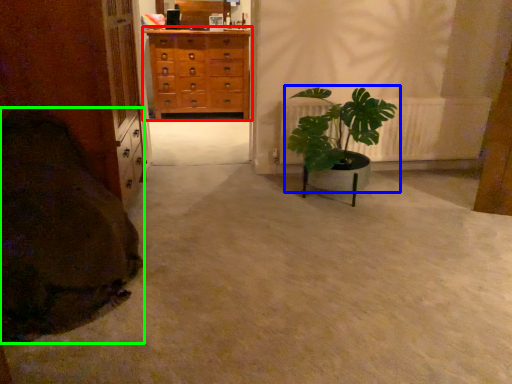
Question: Based on their relative distances, which object is farther from chest of drawers (highlighted by a red box)? Choose from houseplant (highlighted by a blue box) and blanket (highlighted by a green box).

Choices:
 (A) houseplant
 (B) blanket

Answer: (B)